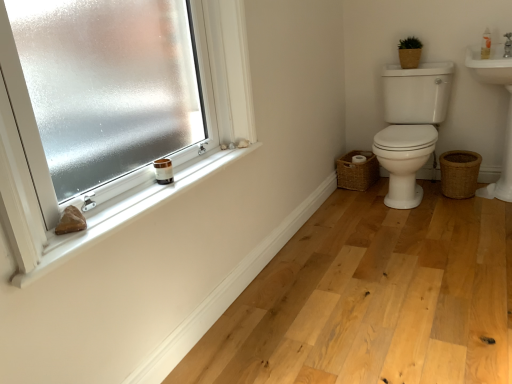
Question: From a real-world perspective, is natural wood floor at lower center physically below frosted glass window at upper left?

Choices:
 (A) yes
 (B) no

Answer: (A)

Question: Is natural wood floor at lower center not within frosted glass window at upper left?

Choices:
 (A) yes
 (B) no

Answer: (A)

Question: Considering the relative sizes of natural wood floor at lower center and frosted glass window at upper left in the image provided, is natural wood floor at lower center shorter than frosted glass window at upper left?

Choices:
 (A) no
 (B) yes

Answer: (B)

Question: Does natural wood floor at lower center come behind frosted glass window at upper left?

Choices:
 (A) yes
 (B) no

Answer: (A)

Question: Are natural wood floor at lower center and frosted glass window at upper left beside each other?

Choices:
 (A) no
 (B) yes

Answer: (A)

Question: Considering the relative sizes of natural wood floor at lower center and frosted glass window at upper left in the image provided, is natural wood floor at lower center bigger than frosted glass window at upper left?

Choices:
 (A) yes
 (B) no

Answer: (B)

Question: Does white ceramic sink at upper right have a greater width compared to brown woven basket at upper right, the 2th basket when ordered from right to left?

Choices:
 (A) yes
 (B) no

Answer: (A)

Question: Is white ceramic sink at upper right smaller than brown woven basket at upper right, placed as the 1th basket when sorted from top to bottom?

Choices:
 (A) no
 (B) yes

Answer: (A)

Question: From the image's perspective, is white ceramic sink at upper right beneath brown woven basket at upper right, the 2th basket when ordered from right to left?

Choices:
 (A) no
 (B) yes

Answer: (B)

Question: From a real-world perspective, is white ceramic sink at upper right positioned under brown woven basket at upper right, which ranks as the 2th basket in left-to-right order, based on gravity?

Choices:
 (A) no
 (B) yes

Answer: (B)

Question: Is white ceramic sink at upper right positioned beyond the bounds of brown woven basket at upper right, placed as the 1th basket when sorted from top to bottom?

Choices:
 (A) yes
 (B) no

Answer: (A)

Question: From the image's perspective, is white ceramic sink at upper right on brown woven basket at upper right, the 3th basket in the bottom-to-top sequence?

Choices:
 (A) no
 (B) yes

Answer: (A)

Question: Considering the relative sizes of white plastic bottle at upper right and natural wood floor at lower center in the image provided, is white plastic bottle at upper right taller than natural wood floor at lower center?

Choices:
 (A) yes
 (B) no

Answer: (A)